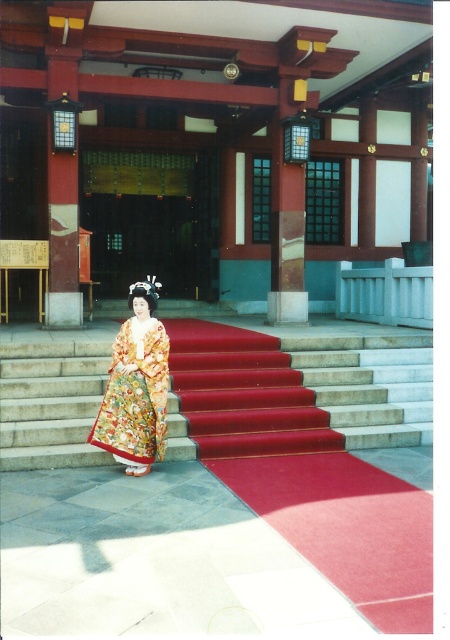
Question: Is smooth concrete stairs at center wider than floral silk kimono at center?

Choices:
 (A) yes
 (B) no

Answer: (A)

Question: Which of the following is the farthest from the observer?

Choices:
 (A) (108, 348)
 (B) (126, 464)

Answer: (A)

Question: Among these objects, which one is nearest to the camera?

Choices:
 (A) floral silk kimono at center
 (B) smooth concrete stairs at center

Answer: (A)

Question: Is smooth concrete stairs at center in front of floral silk kimono at center?

Choices:
 (A) yes
 (B) no

Answer: (B)

Question: Among these objects, which one is nearest to the camera?

Choices:
 (A) smooth concrete stairs at center
 (B) floral silk kimono at center

Answer: (B)

Question: Is smooth concrete stairs at center positioned before floral silk kimono at center?

Choices:
 (A) no
 (B) yes

Answer: (A)